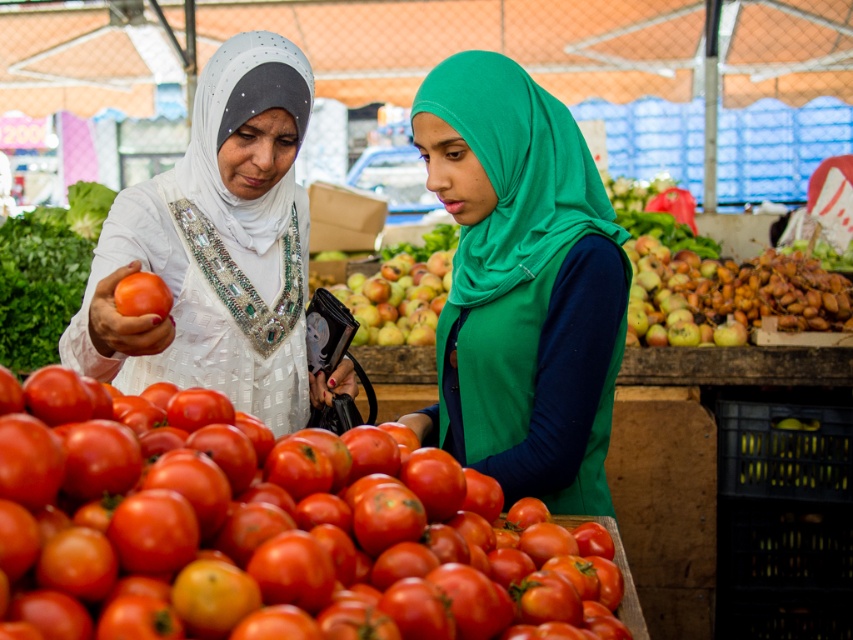
You are a delivery person who needs to place a package between the matte white hijab at center and the red matte tomato at left. The package is 20 inches long. Will it fit in the space between them?

The distance between the matte white hijab at center and the red matte tomato at left is 21.87 inches. Since the package is 20 inches long, it will fit in the space between them.